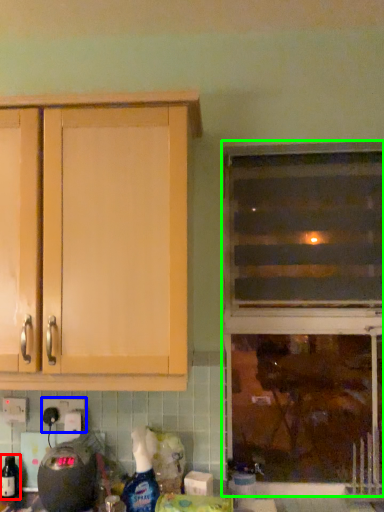
Question: Based on their relative distances, which object is nearer to bottle (highlighted by a red box)? Choose from electric outlet (highlighted by a blue box) and window (highlighted by a green box).

Choices:
 (A) electric outlet
 (B) window

Answer: (A)